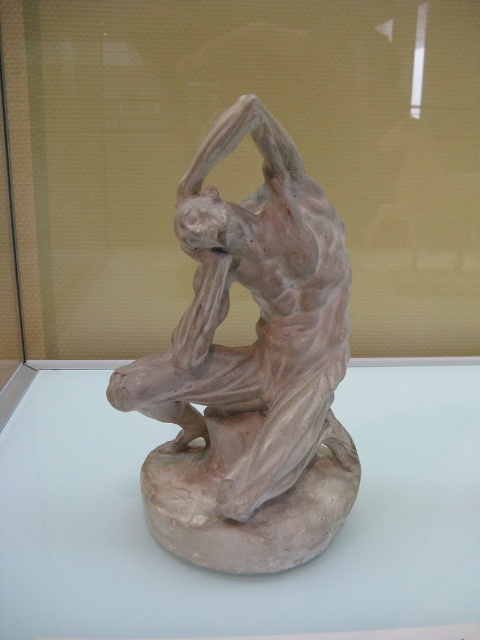
Who is shorter, matte clay sculpture at center or matte clay figure at center?

matte clay sculpture at center

Between point (123, 580) and point (271, 348), which one is positioned behind?

Positioned behind is point (271, 348).

Where is `matte clay sculpture at center`? matte clay sculpture at center is located at coordinates (229, 576).